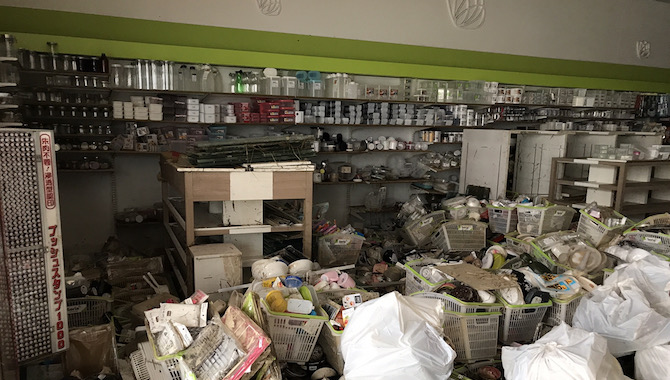
The image size is (670, 380). What are the coordinates of `wall decor` in the screenshot? It's located at (470, 16), (641, 47), (269, 9).